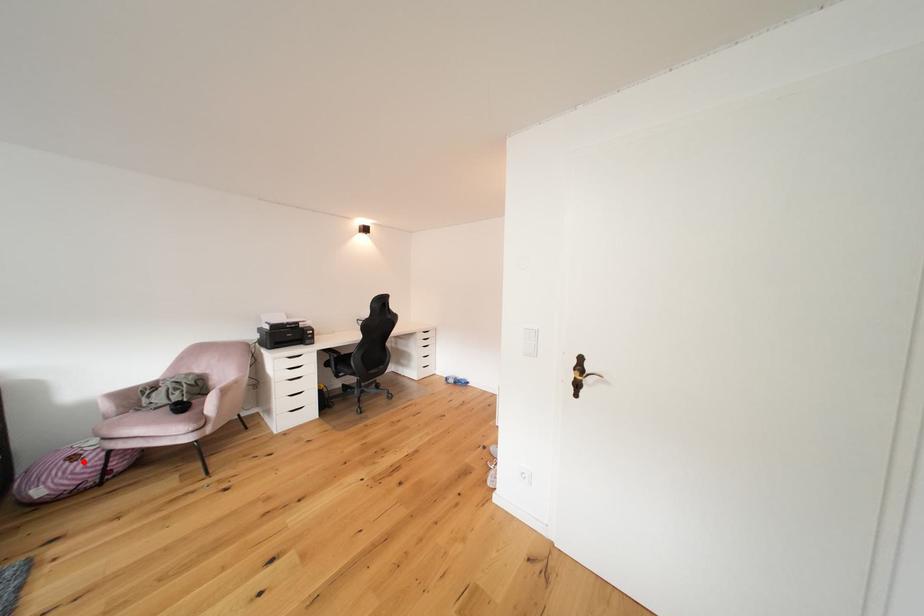
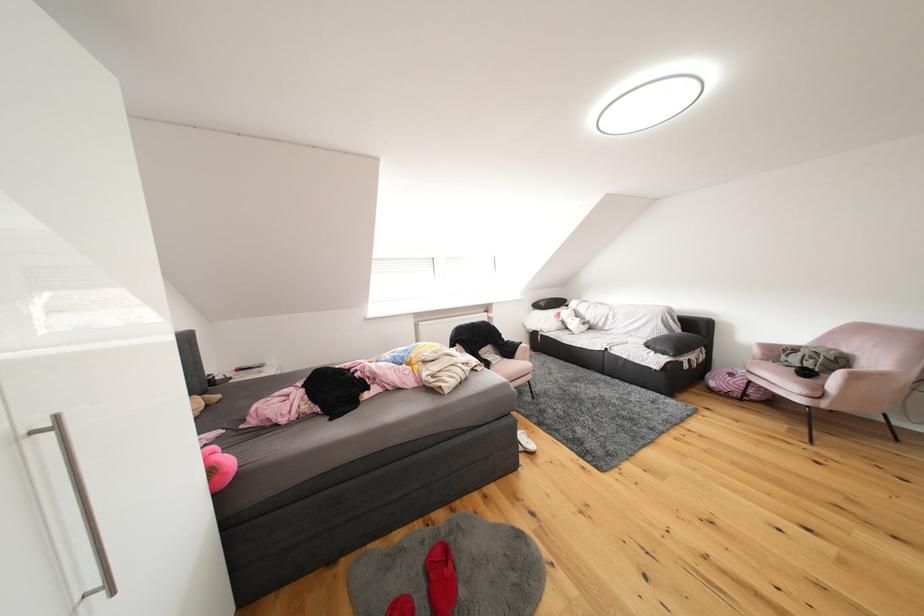
Question: I am providing you with two images of the same scene from different viewpoints. Given a red point in image1, look at the same physical point in image2. Is it:

Choices:
 (A) Closer to the viewpoint
 (B) Farther from the viewpoint

Answer: (A)